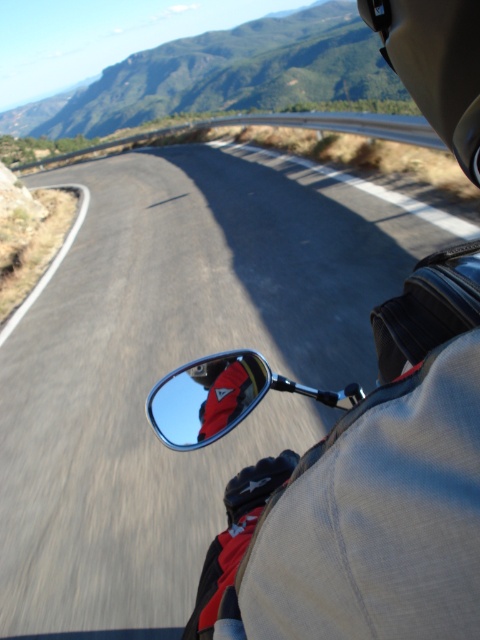
Consider the image. You are a motorcyclist preparing to adjust your side mirror. You notice the polished chrome mirror at lower center and the red leather glove at side mirror. Which object is taller?

The polished chrome mirror at lower center is taller than the red leather glove at side mirror.

You are a motorcyclist checking your side mirror. You notice the polished chrome mirror at lower center and the red leather glove at side mirror. Which object is located to the left of the other?

The polished chrome mirror at lower center is positioned on the left side of red leather glove at side mirror.